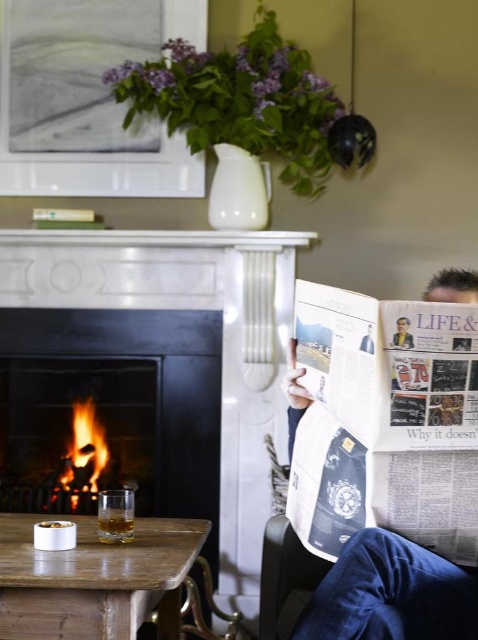
Question: Can you confirm if black metal fireplace at left is positioned below white paper newspaper at right?

Choices:
 (A) yes
 (B) no

Answer: (A)

Question: Which point appears closest to the camera in this image?

Choices:
 (A) (410, 346)
 (B) (0, 602)
 (C) (111, 310)
 (D) (321, 636)

Answer: (A)

Question: Is white paper newspaper at right thinner than matte paper newspaper at center?

Choices:
 (A) no
 (B) yes

Answer: (A)

Question: Estimate the real-world distances between objects in this image. Which object is closer to the wooden table at lower left?

Choices:
 (A) black metal fireplace at left
 (B) white paper newspaper at right

Answer: (B)

Question: Estimate the real-world distances between objects in this image. Which object is farther from the black metal fireplace at left?

Choices:
 (A) wooden table at lower left
 (B) white paper newspaper at right
 (C) matte paper newspaper at center

Answer: (C)

Question: Does wooden table at lower left have a smaller size compared to white paper newspaper at right?

Choices:
 (A) no
 (B) yes

Answer: (A)